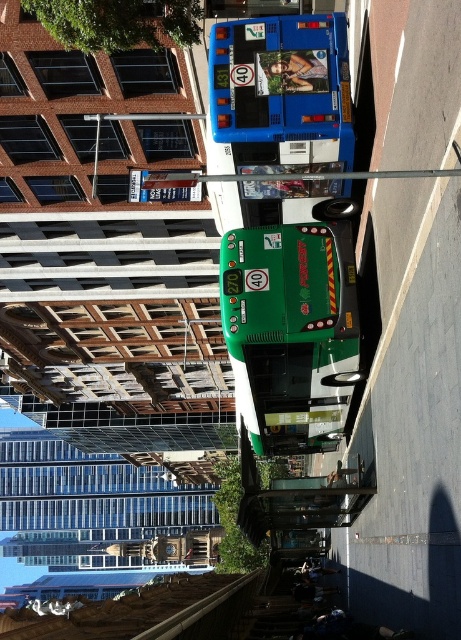
You are a pedestrian waiting at the bus stop and see the green matte bus at center and the blue metallic bus at upper center. Which bus is closer to the left side of the bus stop?

The green matte bus at center is closer to the left side of the bus stop because it is positioned to the left of the blue metallic bus at upper center.

You are a delivery person who needs to place a 20 meter long cargo container between the green matte bus at center and the multi story brick building to the left. Is there enough space between them to fit the cargo container?

The distance between the green matte bus at center and the multi story brick building to the left is 19.70 meters. Since the cargo container is 20 meters long, it will not fit between them as the space is slightly shorter than the container.

You are a city planner analyzing the bus stop layout. The green matte bus at center and the blue metallic bus at upper center are both parked at the same bus stop. Which bus takes up more space horizontally in the image?

The green matte bus at center takes up more space horizontally than the blue metallic bus at upper center because its width surpasses the blue metallic bus at upper center.